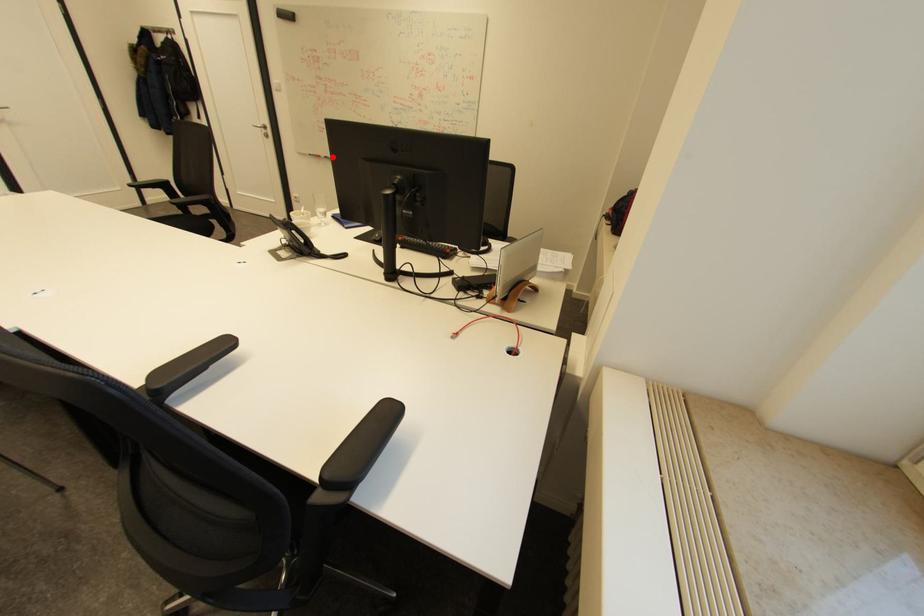
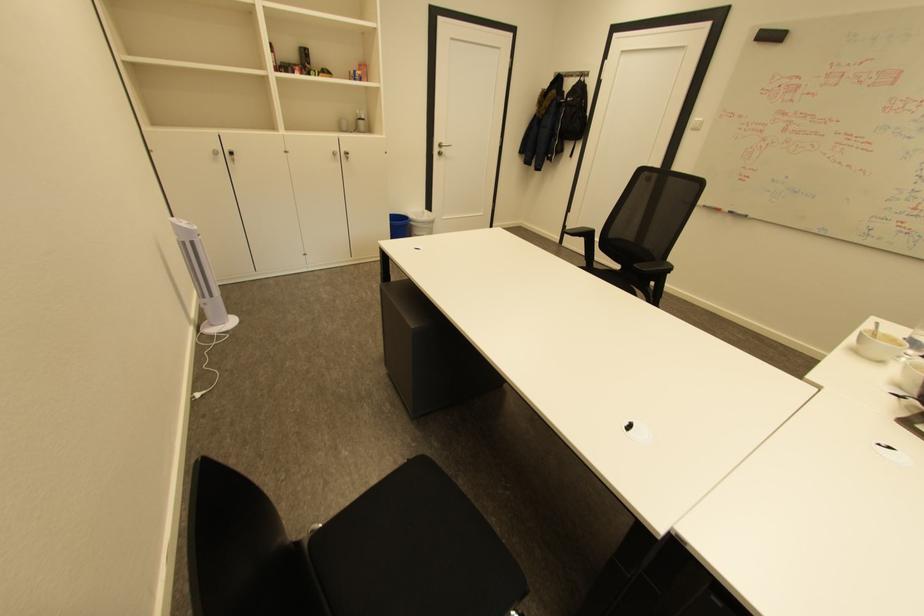
Question: I am providing you with two images of the same scene from different viewpoints. Image1 has a red point marked. In image2, the corresponding 3D location appears at what relative position? Reply with the corresponding letter.

Choices:
 (A) Closer
 (B) Farther

Answer: (A)